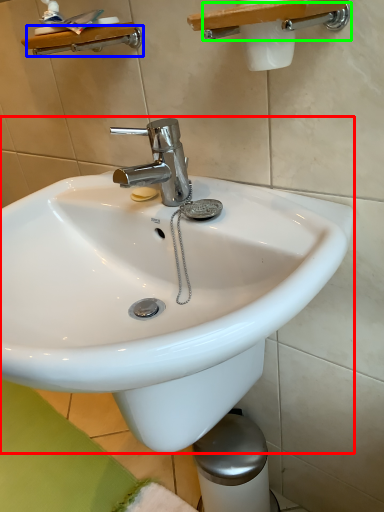
Question: Which object is the farthest from sink (highlighted by a red box)? Choose among these: shower (highlighted by a blue box) or shower (highlighted by a green box).

Choices:
 (A) shower
 (B) shower

Answer: (A)